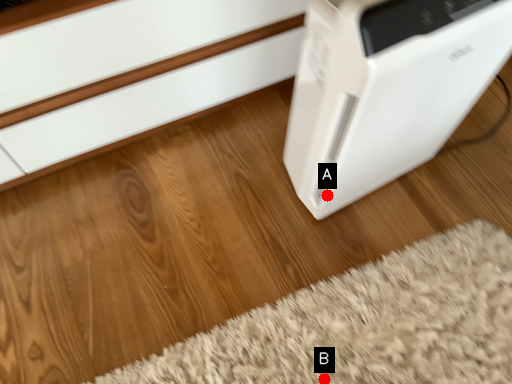
Question: Two points are circled on the image, labeled by A and B beside each circle. Which point is closer to the camera taking this photo?

Choices:
 (A) A is closer
 (B) B is closer

Answer: (B)